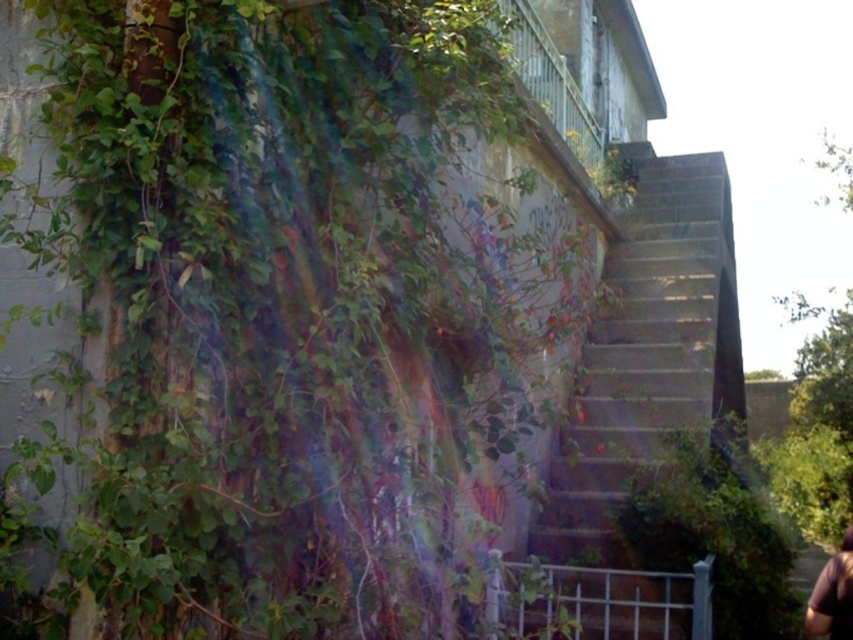
You are standing in front of the weathered wall with climbing plants. You notice the green leafy plant at upper left and the brown fabric at lower right. Which object is closer to you?

→ The green leafy plant at upper left is closer to you since it is in front of the brown fabric at lower right.

Consider the image. You are standing at the base of the stairs and want to reach the green leafy plant at lower right. Which direction should you move relative to the green leafy plant at upper left to get there?

You should move to the right relative to the green leafy plant at upper left to reach the green leafy plant at lower right because the green leafy plant at upper left is to the left of the green leafy plant at lower right.